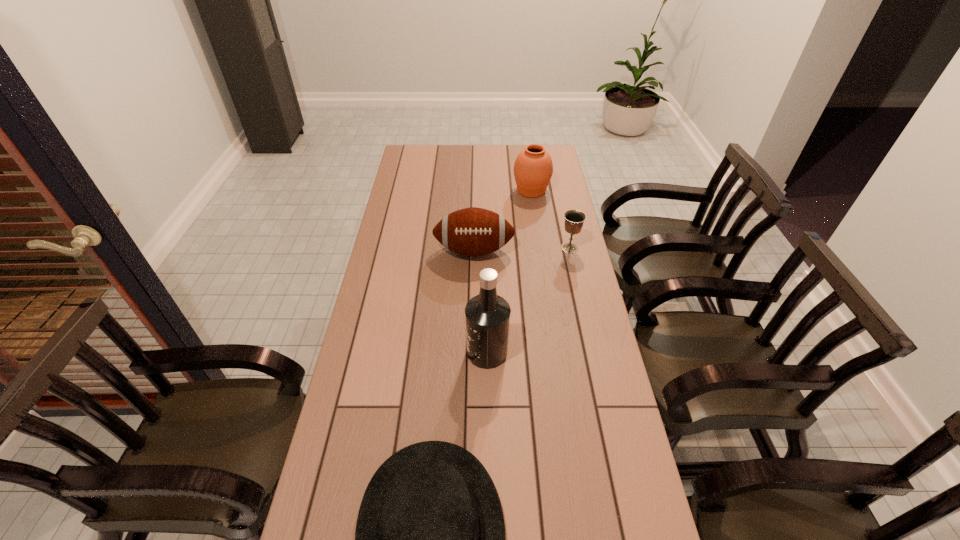
Find the location of a particular element. The width and height of the screenshot is (960, 540). free spot located on the back of the chalice is located at coordinates (560, 205).

Where is `urn situated at the right edge`? urn situated at the right edge is located at coordinates (533, 168).

Where is `chalice that is at the right edge`? The width and height of the screenshot is (960, 540). chalice that is at the right edge is located at coordinates (574, 219).

In the image, there is a desktop. Where is `free space at the far edge`? The height and width of the screenshot is (540, 960). free space at the far edge is located at coordinates (468, 157).

Identify the location of free space at the left edge of the desktop. This screenshot has width=960, height=540. (398, 213).

Find the location of a particular element. The height and width of the screenshot is (540, 960). blank space at the right edge is located at coordinates (568, 442).

In the image, there is a desktop. Identify the location of free region at the far right corner. (544, 146).

Locate an element on the screen. free space that is in between the liquor and the urn is located at coordinates (509, 272).

Locate which object ranks third in proximity to the chalice. Please provide its 2D coordinates. Your answer should be formatted as a tuple, i.e. [(x, y)], where the tuple contains the x and y coordinates of a point satisfying the conditions above.

[(487, 315)]

I want to click on object that is the second closest to the chalice, so click(x=533, y=168).